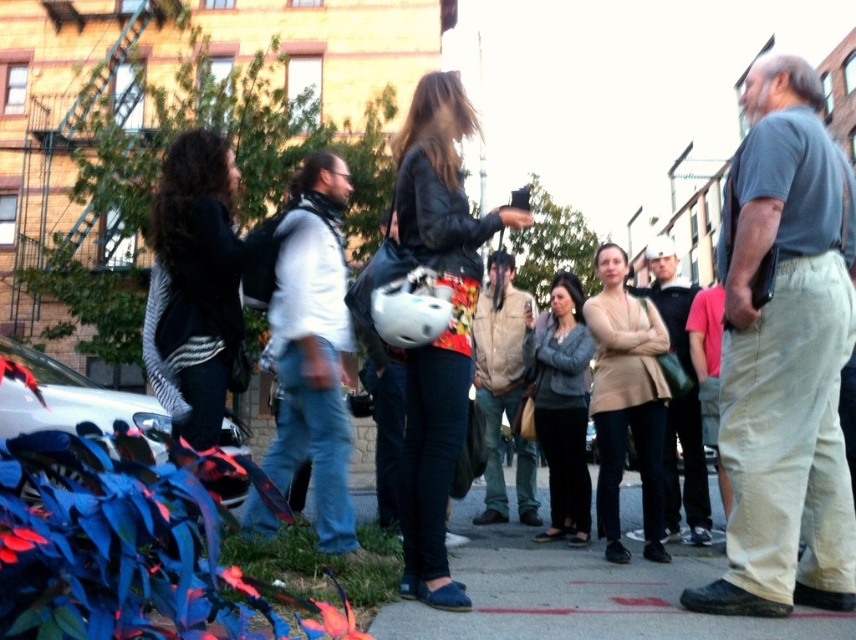
Question: Is leather jacket at center wider than concrete sidewalk at center?

Choices:
 (A) no
 (B) yes

Answer: (A)

Question: Based on their relative distances, which object is farther from the light brown leather jacket at center?

Choices:
 (A) white matte vest at center
 (B) tan suede jacket at center
 (C) gray knit sweater at center

Answer: (A)

Question: Is leather jacket at center wider than beige textured sweater at center?

Choices:
 (A) yes
 (B) no

Answer: (A)

Question: Which point is closer to the camera taking this photo?

Choices:
 (A) (512, 376)
 (B) (639, 404)
 (C) (444, 604)
 (D) (694, 529)

Answer: (C)

Question: Can you confirm if concrete sidewalk at center is wider than gray knit sweater at center?

Choices:
 (A) no
 (B) yes

Answer: (B)

Question: Among these objects, which one is nearest to the camera?

Choices:
 (A) gray cotton shirt at right
 (B) leather jacket at center
 (C) white matte vest at center

Answer: (A)